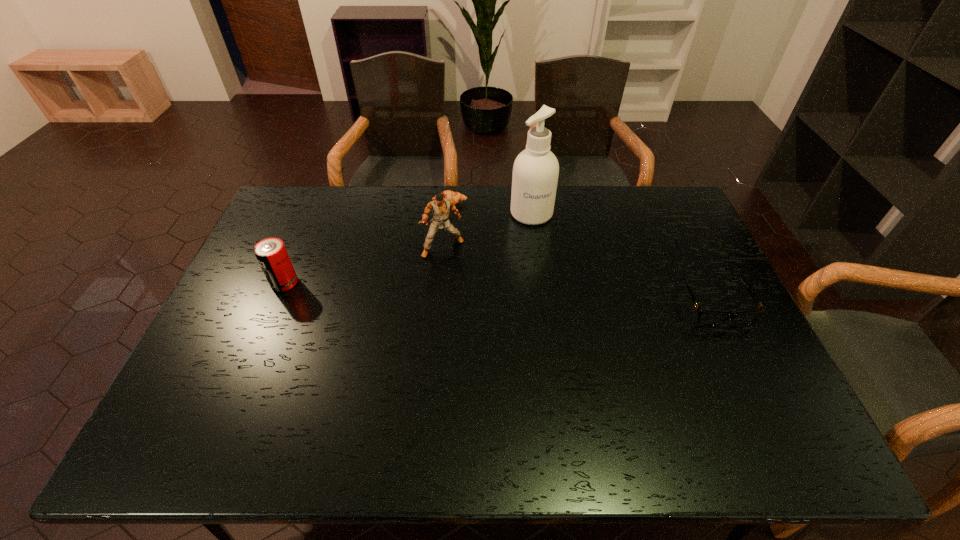
Find the location of a particular element. Image resolution: width=960 pixels, height=540 pixels. vacant space located on the front-facing side of the sunglasses is located at coordinates (753, 384).

I want to click on vacant space located on the front-facing side of the pastry, so click(455, 261).

The image size is (960, 540). I want to click on vacant space located on the front-facing side of the pastry, so click(x=457, y=286).

Where is `free space located on the front-facing side of the pastry`? This screenshot has height=540, width=960. free space located on the front-facing side of the pastry is located at coordinates (456, 272).

Identify the location of free space located 0.270m on the front-facing side of the third nearest object. (478, 323).

The height and width of the screenshot is (540, 960). I want to click on free region located on the front-facing side of the third nearest object, so click(468, 300).

At what (x,y) coordinates should I click in order to perform the action: click on free space located 0.070m on the front-facing side of the third nearest object. Please return your answer as a coordinate pair (x, y). Image resolution: width=960 pixels, height=540 pixels. Looking at the image, I should click on (456, 274).

Locate an element on the screen. free region located 0.060m on the front label of the tallest object is located at coordinates (540, 239).

Identify the location of vacant space located on the front label of the tallest object. This screenshot has height=540, width=960. (549, 273).

Image resolution: width=960 pixels, height=540 pixels. In order to click on vacant region located on the front label of the tallest object in this screenshot , I will do `click(544, 255)`.